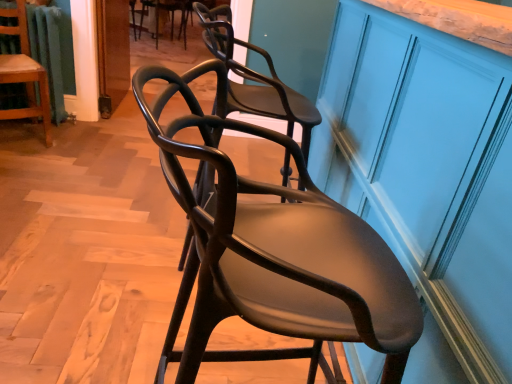
I want to click on matte blue cabinet at right, so click(x=428, y=175).

I want to click on matte black chair at upper center, marked as the third chair in a front-to-back arrangement, so click(x=170, y=17).

From the image's perspective, who appears lower, matte black chair at upper center, marked as the 2th chair in a left-to-right arrangement, or wooden chair at left, placed as the third chair when sorted from right to left?

wooden chair at left, placed as the third chair when sorted from right to left, is shown below in the image.

Can you confirm if matte black chair at upper center, the 1th chair when ordered from top to bottom, is taller than wooden chair at left, acting as the 1th chair starting from the left?

No.

Which is less distant, (157, 9) or (38, 64)?

The point (38, 64) is closer to the camera.

Does matte dark wood chair at center, the first chair viewed from the front, have a greater width compared to matte black chair at upper center, the second chair when ordered from right to left?

In fact, matte dark wood chair at center, the first chair viewed from the front, might be narrower than matte black chair at upper center, the second chair when ordered from right to left.

Considering the sizes of objects matte dark wood chair at center, placed as the third chair when sorted from top to bottom, and matte black chair at upper center, positioned as the third chair in bottom-to-top order, in the image provided, who is smaller, matte dark wood chair at center, placed as the third chair when sorted from top to bottom, or matte black chair at upper center, positioned as the third chair in bottom-to-top order,?

With smaller size is matte black chair at upper center, positioned as the third chair in bottom-to-top order.

Which is closer, (161, 134) or (172, 8)?

The point (161, 134) is closer.

Looking at this image, is matte dark wood chair at center, which is the 3th chair in back-to-front order, next to matte black chair at upper center, the 1th chair when ordered from top to bottom?

No, matte dark wood chair at center, which is the 3th chair in back-to-front order, is not beside matte black chair at upper center, the 1th chair when ordered from top to bottom.

From the image's perspective, is matte black chair at upper center, positioned as the third chair in bottom-to-top order, under matte dark wood chair at center, acting as the 3th chair starting from the left?

Incorrect, from the image's perspective, matte black chair at upper center, positioned as the third chair in bottom-to-top order, is higher than matte dark wood chair at center, acting as the 3th chair starting from the left.

Is matte black chair at upper center, the 1th chair when ordered from back to front, looking in the opposite direction of matte dark wood chair at center, which is the 3th chair in back-to-front order?

Yes, matte black chair at upper center, the 1th chair when ordered from back to front, is positioned with its back facing matte dark wood chair at center, which is the 3th chair in back-to-front order.

Based on their positions, is matte black chair at upper center, positioned as the third chair in bottom-to-top order, located to the left or right of matte dark wood chair at center, placed as the third chair when sorted from top to bottom?

From the image, it's evident that matte black chair at upper center, positioned as the third chair in bottom-to-top order, is to the left of matte dark wood chair at center, placed as the third chair when sorted from top to bottom.

Which is behind, point (158, 35) or point (233, 230)?

The point (158, 35) is farther from the camera.

Does matte dark wood chair at center, which appears as the 1th chair when ordered from the bottom, have a lesser width compared to matte blue cabinet at right?

Yes.

From the image's perspective, which object appears higher, matte dark wood chair at center, placed as the first chair when sorted from right to left, or matte blue cabinet at right?

matte blue cabinet at right.

Choose the correct answer: Is matte dark wood chair at center, which is the 3th chair in back-to-front order, inside matte blue cabinet at right or outside it?

matte dark wood chair at center, which is the 3th chair in back-to-front order, is not enclosed by matte blue cabinet at right.

Which of these two, matte dark wood chair at center, the first chair viewed from the front, or matte blue cabinet at right, stands shorter?

matte dark wood chair at center, the first chair viewed from the front.

From the picture: Is matte blue cabinet at right positioned behind matte dark wood chair at center, placed as the first chair when sorted from right to left?

No, matte blue cabinet at right is closer to the camera.

From the picture: Could you measure the distance between matte blue cabinet at right and matte dark wood chair at center, which appears as the 1th chair when ordered from the bottom?

matte blue cabinet at right is 14.50 inches from matte dark wood chair at center, which appears as the 1th chair when ordered from the bottom.

Considering the sizes of objects matte blue cabinet at right and matte dark wood chair at center, placed as the first chair when sorted from right to left, in the image provided, who is taller, matte blue cabinet at right or matte dark wood chair at center, placed as the first chair when sorted from right to left,?

With more height is matte blue cabinet at right.

In terms of width, does matte blue cabinet at right look wider or thinner when compared to matte dark wood chair at center, which appears as the 1th chair when ordered from the bottom?

In the image, matte blue cabinet at right appears to be wider than matte dark wood chair at center, which appears as the 1th chair when ordered from the bottom.

Are matte blue cabinet at right and matte black chair at upper center, positioned as the third chair in bottom-to-top order, beside each other?

They are not placed beside each other.

Which object is thinner, matte blue cabinet at right or matte black chair at upper center, marked as the 2th chair in a left-to-right arrangement?

matte blue cabinet at right is thinner.

From a real-world perspective, between matte blue cabinet at right and matte black chair at upper center, the 1th chair when ordered from back to front, who is vertically lower?

From a 3D spatial view, matte black chair at upper center, the 1th chair when ordered from back to front, is below.

From the picture: Does matte blue cabinet at right come behind matte black chair at upper center, the 1th chair when ordered from back to front?

No, it is not.

How distant is wooden chair at left, which is counted as the second chair, starting from the bottom, from matte blue cabinet at right?

wooden chair at left, which is counted as the second chair, starting from the bottom, is 6.53 feet from matte blue cabinet at right.

Which of these two, wooden chair at left, placed as the third chair when sorted from right to left, or matte blue cabinet at right, is thinner?

With smaller width is wooden chair at left, placed as the third chair when sorted from right to left.

From the image's perspective, which object appears higher, wooden chair at left, which is counted as the second chair, starting from the bottom, or matte blue cabinet at right?

From the image's view, wooden chair at left, which is counted as the second chair, starting from the bottom, is above.

Are wooden chair at left, which appears as the 2th chair when viewed from the back, and matte blue cabinet at right making contact?

There is a gap between wooden chair at left, which appears as the 2th chair when viewed from the back, and matte blue cabinet at right.

The width and height of the screenshot is (512, 384). I want to click on the 1st chair positioned above the matte black chair at upper center, the second chair when ordered from right to left (from a real-world perspective), so click(x=24, y=73).

This screenshot has height=384, width=512. I want to click on the 2nd chair below the matte black chair at upper center, the 1th chair when ordered from top to bottom (from the image's perspective), so click(x=273, y=252).

From the image, which object appears to be farther from wooden chair at left, which is counted as the second chair, starting from the bottom, matte black chair at upper center, marked as the third chair in a front-to-back arrangement, or matte blue cabinet at right?

matte black chair at upper center, marked as the third chair in a front-to-back arrangement.

Which object lies nearer to the anchor point matte black chair at upper center, marked as the third chair in a front-to-back arrangement, matte dark wood chair at center, which appears as the 1th chair when ordered from the bottom, or wooden chair at left, which is counted as the second chair, starting from the bottom?

wooden chair at left, which is counted as the second chair, starting from the bottom.

Considering their positions, is wooden chair at left, acting as the 1th chair starting from the left, positioned closer to matte blue cabinet at right than matte black chair at upper center, marked as the 2th chair in a left-to-right arrangement?

wooden chair at left, acting as the 1th chair starting from the left, lies closer to matte blue cabinet at right than the other object.

Which object lies nearer to the anchor point matte dark wood chair at center, placed as the first chair when sorted from right to left, wooden chair at left, placed as the third chair when sorted from right to left, or matte blue cabinet at right?

matte blue cabinet at right.

Looking at the image, which one is located closer to matte dark wood chair at center, acting as the 3th chair starting from the left, matte black chair at upper center, the 1th chair when ordered from back to front, or wooden chair at left, which is counted as the second chair, starting from the bottom?

wooden chair at left, which is counted as the second chair, starting from the bottom, is closer to matte dark wood chair at center, acting as the 3th chair starting from the left.

Which object lies further to the anchor point matte black chair at upper center, marked as the third chair in a front-to-back arrangement, matte blue cabinet at right or matte dark wood chair at center, which is the 3th chair in back-to-front order?

The object further to matte black chair at upper center, marked as the third chair in a front-to-back arrangement, is matte dark wood chair at center, which is the 3th chair in back-to-front order.

From the image, which object appears to be nearer to matte blue cabinet at right, matte dark wood chair at center, acting as the 3th chair starting from the left, or matte black chair at upper center, positioned as the third chair in bottom-to-top order?

Based on the image, matte dark wood chair at center, acting as the 3th chair starting from the left, appears to be nearer to matte blue cabinet at right.

Based on their spatial positions, is matte black chair at upper center, positioned as the third chair in bottom-to-top order, or wooden chair at left, which is counted as the second chair, starting from the bottom, further from matte blue cabinet at right?

matte black chair at upper center, positioned as the third chair in bottom-to-top order, lies further to matte blue cabinet at right than the other object.

Locate an element on the screen. The width and height of the screenshot is (512, 384). chair between matte dark wood chair at center, which is the 3th chair in back-to-front order, and matte black chair at upper center, the 1th chair when ordered from top to bottom, along the z-axis is located at coordinates (24, 73).